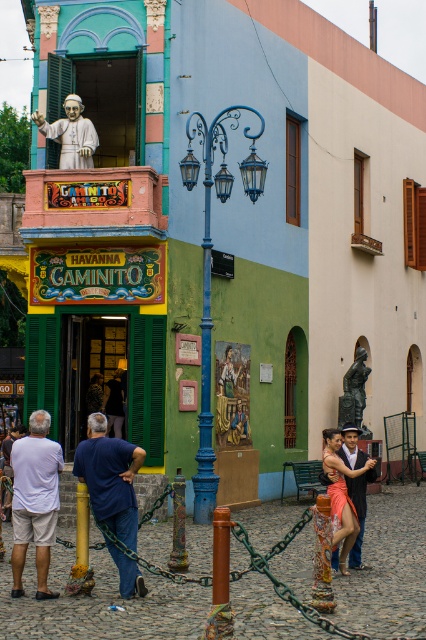
Can you confirm if blue cotton shirt at lower left is wider than white glossy statue at upper left?

No.

Between point (101, 472) and point (71, 96), which one is positioned in front?

Positioned in front is point (101, 472).

Locate an element on the screen. blue cotton shirt at lower left is located at coordinates (109, 477).

Is point (37, 556) in front of point (80, 500)?

Yes, it is in front of point (80, 500).

How much distance is there between white cotton shirt at lower left and brushed metal pole at center?

They are 1.71 meters apart.

You are a GUI agent. You are given a task and a screenshot of the screen. Output one action in this format:
    pyautogui.click(x=<x>, y=<y>)
    Task: Click on the white cotton shirt at lower left
    The height and width of the screenshot is (640, 426).
    Given the screenshot: What is the action you would take?
    pyautogui.click(x=34, y=500)

The height and width of the screenshot is (640, 426). What are the coordinates of `white cotton shirt at lower left` in the screenshot? It's located at (34, 500).

Based on the photo, who is positioned more to the left, matte pink dress at center or metallic pole at center?

Positioned to the left is metallic pole at center.

Is matte pink dress at center to the right of metallic pole at center from the viewer's perspective?

Correct, you'll find matte pink dress at center to the right of metallic pole at center.

You are a GUI agent. You are given a task and a screenshot of the screen. Output one action in this format:
    pyautogui.click(x=<x>, y=<y>)
    Task: Click on the matte pink dress at center
    This screenshot has width=426, height=640.
    Given the screenshot: What is the action you would take?
    pyautogui.click(x=345, y=492)